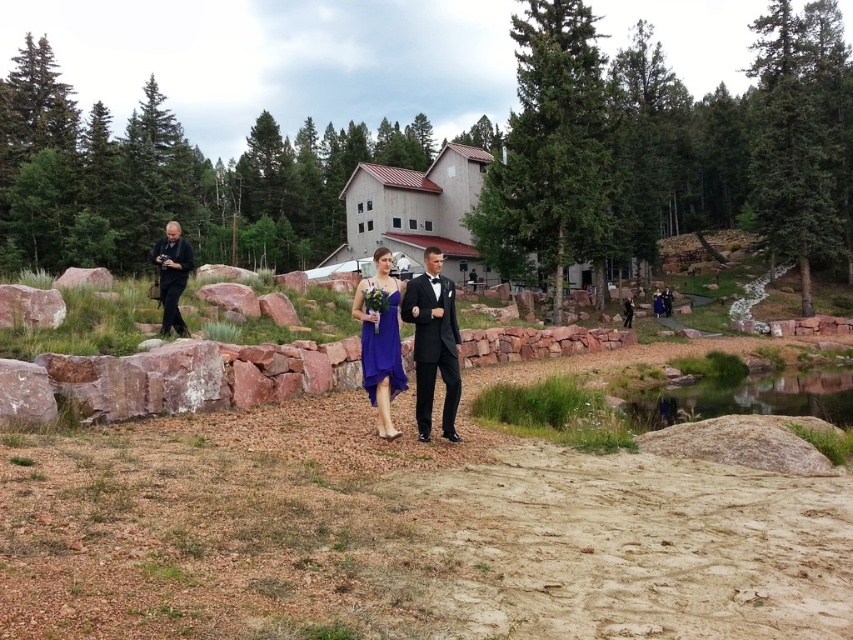
Question: Considering the relative positions of clear water at lower right and shiny black suit at center in the image provided, where is clear water at lower right located with respect to shiny black suit at center?

Choices:
 (A) left
 (B) right

Answer: (B)

Question: Which object is closer to the camera taking this photo?

Choices:
 (A) clear water at lower right
 (B) shiny black suit at center
 (C) matte purple dress at center

Answer: (B)

Question: Does shiny black suit at center have a larger size compared to black matte camera at left?

Choices:
 (A) no
 (B) yes

Answer: (B)

Question: Estimate the real-world distances between objects in this image. Which object is closer to the clear water at lower right?

Choices:
 (A) satin blue dress at center
 (B) matte purple dress at center
 (C) black matte camera at left

Answer: (A)

Question: Is shiny black suit at center below matte purple dress at center?

Choices:
 (A) yes
 (B) no

Answer: (A)

Question: Which of the following is the closest to the observer?

Choices:
 (A) (172, 266)
 (B) (407, 310)
 (C) (390, 388)

Answer: (B)